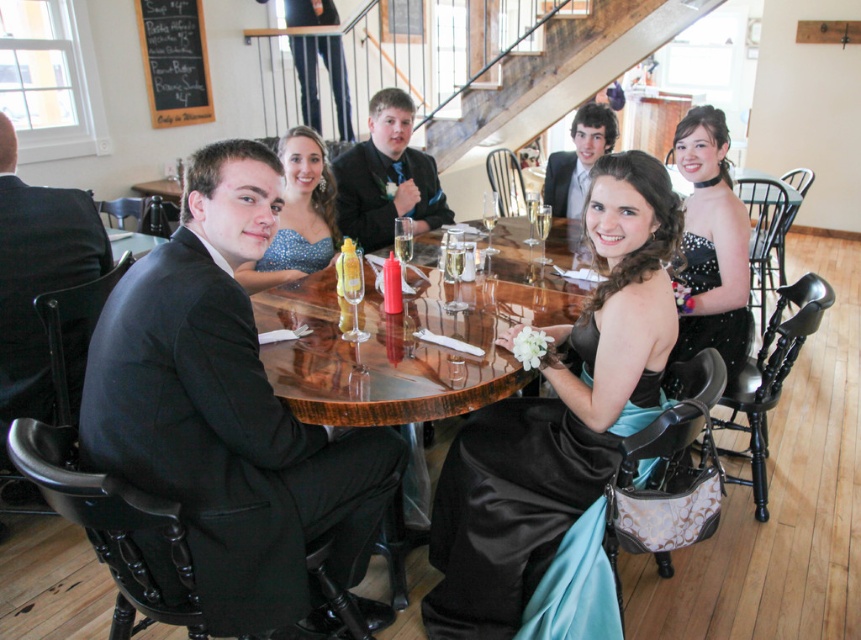
Question: Is the position of matte black suit at left less distant than that of black satin suit at left?

Choices:
 (A) no
 (B) yes

Answer: (B)

Question: Can you confirm if black chalkboard menu at upper left is positioned above blue satin dress at center?

Choices:
 (A) no
 (B) yes

Answer: (B)

Question: Which point is farther to the camera?

Choices:
 (A) (539, 323)
 (B) (314, 189)

Answer: (B)

Question: Can you confirm if wooden at center is positioned to the left of black satin dress at center?

Choices:
 (A) yes
 (B) no

Answer: (A)

Question: Which object appears closest to the camera in this image?

Choices:
 (A) matte black suit at center
 (B) matte black suit at left
 (C) satin black dress at center
 (D) translucent glass wine at table center

Answer: (B)

Question: Which of the following is the farthest from the observer?

Choices:
 (A) black chalkboard menu at upper left
 (B) blue satin dress at center

Answer: (A)